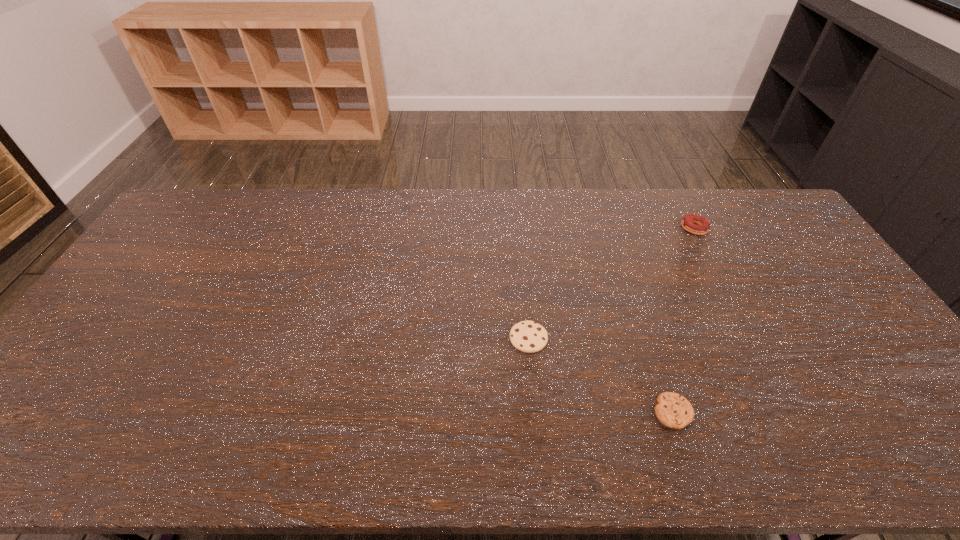
You are a GUI agent. You are given a task and a screenshot of the screen. Output one action in this format:
    pyautogui.click(x=<x>, y=<y>)
    Task: Click on the rightmost object
    This screenshot has width=960, height=540.
    Given the screenshot: What is the action you would take?
    pyautogui.click(x=689, y=222)

Where is `doughnut`? doughnut is located at coordinates (689, 222).

The image size is (960, 540). In order to click on the taller cookie in this screenshot , I will do `click(527, 336)`.

Where is `the left cookie`? the left cookie is located at coordinates (527, 336).

The image size is (960, 540). In order to click on the nearer cookie in this screenshot , I will do coord(674,411).

The width and height of the screenshot is (960, 540). Find the location of `the right cookie`. the right cookie is located at coordinates (674, 411).

Find the location of `free region located 0.290m on the left of the rightmost object`. free region located 0.290m on the left of the rightmost object is located at coordinates (597, 228).

This screenshot has width=960, height=540. I want to click on free location located 0.280m on the left of the farther cookie, so click(406, 339).

Locate an element on the screen. This screenshot has height=540, width=960. vacant area located 0.230m on the right of the nearer cookie is located at coordinates (788, 412).

Find the location of `object that is positioned at the far edge`. object that is positioned at the far edge is located at coordinates (689, 222).